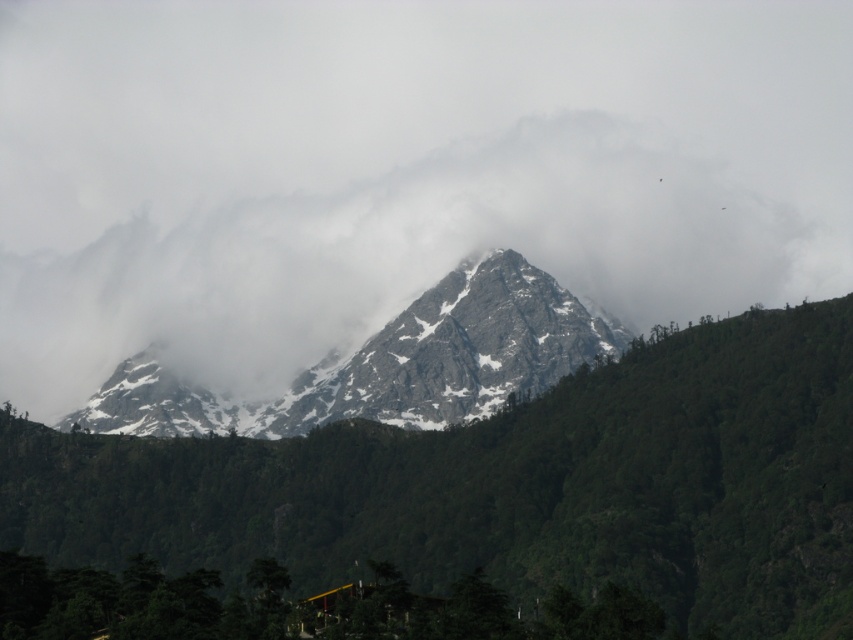
How distant is white fluffy cloud at center from snowy granite peak at center?

They are 31.59 meters apart.

At what (x,y) coordinates should I click in order to perform the action: click on white fluffy cloud at center. Please return your answer as a coordinate pair (x, y). Looking at the image, I should click on (405, 259).

You are a GUI agent. You are given a task and a screenshot of the screen. Output one action in this format:
    pyautogui.click(x=<x>, y=<y>)
    Task: Click on the white fluffy cloud at center
    The width and height of the screenshot is (853, 640).
    Given the screenshot: What is the action you would take?
    pyautogui.click(x=405, y=259)

Which is more to the right, snowy rocky mountain at center or snowy granite peak at center?

snowy rocky mountain at center is more to the right.

Does snowy rocky mountain at center appear over snowy granite peak at center?

No, snowy rocky mountain at center is not above snowy granite peak at center.

Is point (833, 320) positioned behind point (550, 323)?

Yes, it is behind point (550, 323).

Where is `snowy rocky mountain at center`? Image resolution: width=853 pixels, height=640 pixels. snowy rocky mountain at center is located at coordinates (512, 486).

Is point (747, 621) farther from viewer compared to point (45, 337)?

No.

The image size is (853, 640). Describe the element at coordinates (512, 486) in the screenshot. I see `snowy rocky mountain at center` at that location.

Does point (303, 573) come behind point (155, 269)?

That is False.

Locate an element on the screen. Image resolution: width=853 pixels, height=640 pixels. snowy rocky mountain at center is located at coordinates (512, 486).